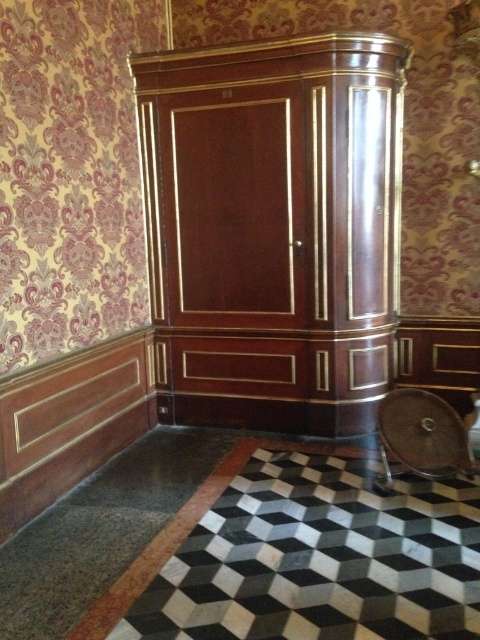
You are an interior designer assessing the space. You need to ensure that the brown leather chair at lower right does not block the view of the mahogany wood armoire at center when viewed from the entrance. Given their heights, is this arrangement feasible?

The mahogany wood armoire at center is taller than the brown leather chair at lower right, so it will likely remain visible even if positioned behind the chair, making the arrangement feasible.

You are standing in the elegantly decorated room and want to move from the point at coordinates point (278,152) to the point at coordinates point (446,417). Can you walk directly between these two points without any obstacles?

Point (278,152) is behind point (446,417), so you cannot walk directly between them as the path is blocked by the object in front.

You are standing in the room and want to move the brown leather chair at lower right closer to the mahogany wood armoire at center. Can you do this without moving the armoire?

The brown leather chair at lower right is behind the mahogany wood armoire at center, so you can move it closer by pulling it forward towards the armoire without needing to move the armoire itself.